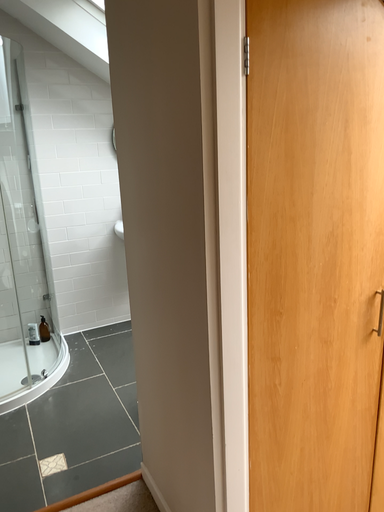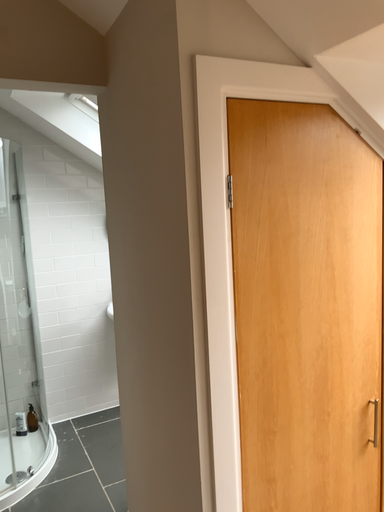
Question: Which way did the camera rotate in the video?

Choices:
 (A) rotated upward
 (B) rotated downward

Answer: (A)